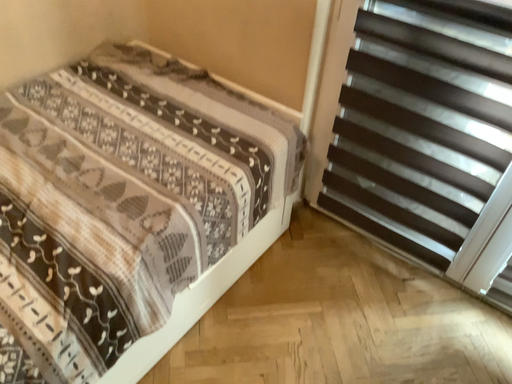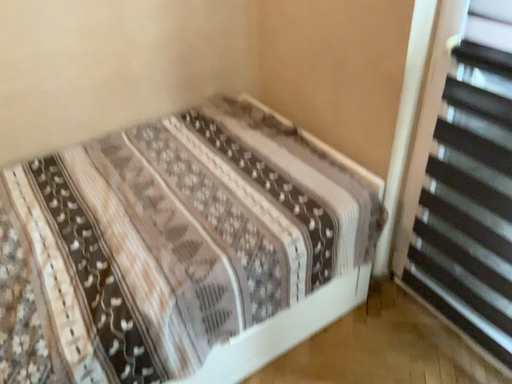
Question: How did the camera likely rotate when shooting the video?

Choices:
 (A) rotated left
 (B) rotated right

Answer: (A)